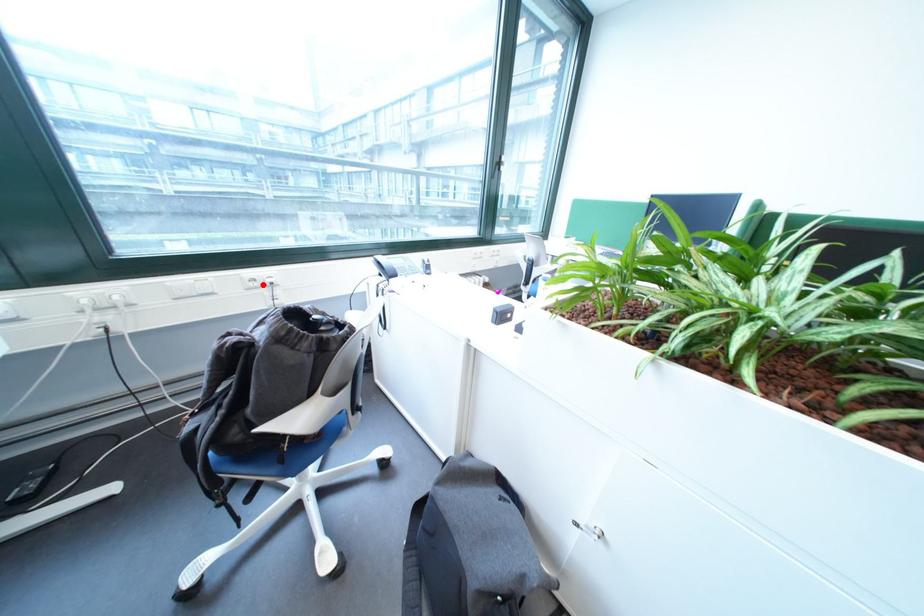
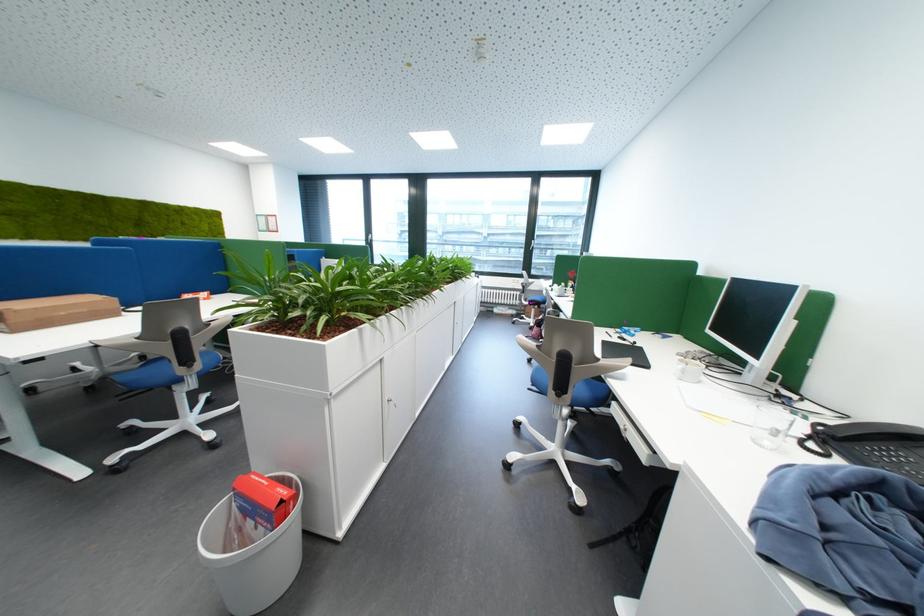
Question: I am providing you with two images of the same scene from different viewpoints. A red point is marked on the first image. Can you still see the location of the red point in image 2?

Choices:
 (A) Yes
 (B) No

Answer: (B)